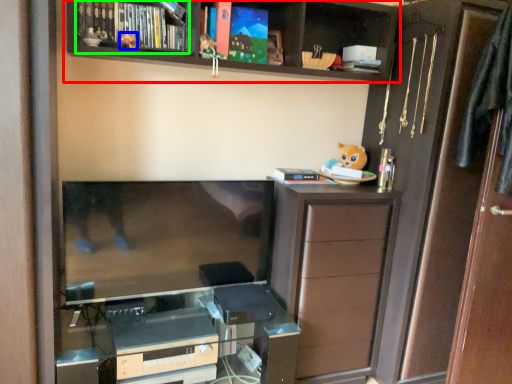
Question: Estimate the real-world distances between objects in this image. Which object is farther from shelf (highlighted by a red box), toy (highlighted by a blue box) or book (highlighted by a green box)?

Choices:
 (A) toy
 (B) book

Answer: (A)